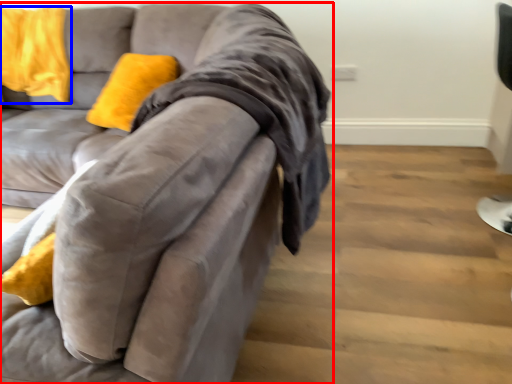
Question: Which point is further to the camera, studio couch (highlighted by a red box) or pillow (highlighted by a blue box)?

Choices:
 (A) studio couch
 (B) pillow

Answer: (B)